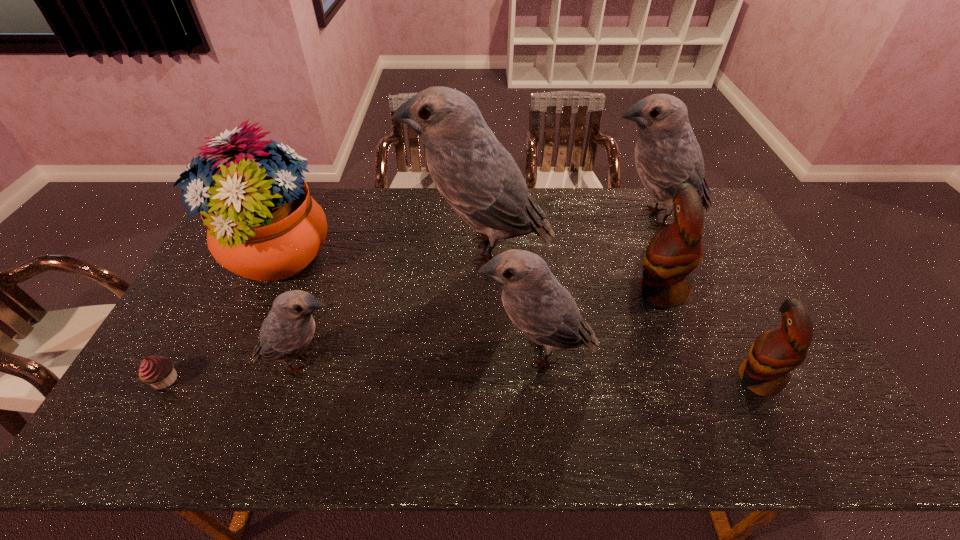
Locate an element on the screen. The height and width of the screenshot is (540, 960). the smaller red parrot is located at coordinates (766, 371).

Locate an element on the screen. This screenshot has height=540, width=960. the nearer red parrot is located at coordinates (766, 371).

Identify the location of the shortest object. coord(158,371).

Where is `cupcake`? The image size is (960, 540). cupcake is located at coordinates (158, 371).

Find the location of a particular element. Image resolution: width=960 pixels, height=540 pixels. vacant space located 0.200m on the front-facing side of the tallest object is located at coordinates (349, 250).

This screenshot has height=540, width=960. In order to click on free space located on the front-facing side of the tallest object in this screenshot , I will do `click(307, 250)`.

The height and width of the screenshot is (540, 960). I want to click on vacant space located 0.100m on the front-facing side of the tallest object, so click(380, 250).

You are a GUI agent. You are given a task and a screenshot of the screen. Output one action in this format:
    pyautogui.click(x=<x>, y=<y>)
    Task: Click on the vacant space located on the front-facing side of the second tallest parrot
    This screenshot has width=960, height=540.
    Given the screenshot: What is the action you would take?
    pyautogui.click(x=583, y=219)

Identify the location of free space located on the front-facing side of the second tallest parrot. 504,219.

Find the location of a particular element. This screenshot has width=960, height=540. blank space located 0.170m on the front-facing side of the second tallest parrot is located at coordinates (549, 219).